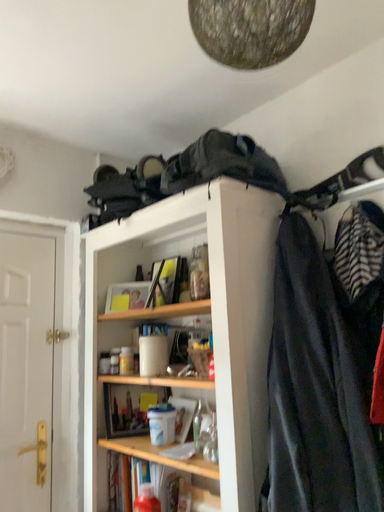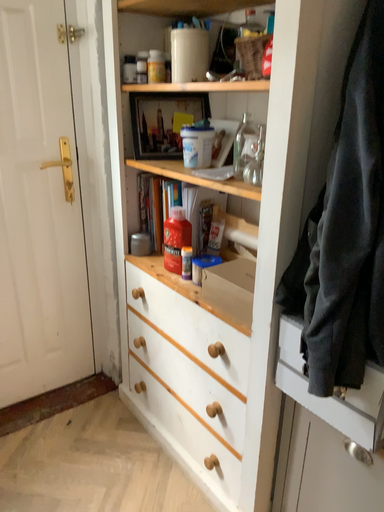
Question: Which way did the camera rotate in the video?

Choices:
 (A) rotated upward
 (B) rotated downward

Answer: (B)